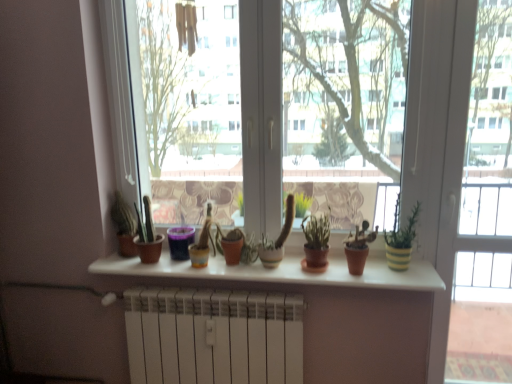
What do you see at coordinates (180, 242) in the screenshot?
I see `purple plastic cup at center, the first flowerpot when ordered from left to right` at bounding box center [180, 242].

Find the location of `matte terracotta pot at center, arranged as the second flowerpot when viewed from the left`. matte terracotta pot at center, arranged as the second flowerpot when viewed from the left is located at coordinates (232, 250).

Looking at this image, how much space does yellow striped pot at right, which is the second houseplant from left to right, occupy horizontally?

It is 6.03 inches.

In order to face green matte plant at center, which is the second houseplant from right to left, should I rotate leftwards or rightwards?

A 8.235 degree turn to the right will do.

The height and width of the screenshot is (384, 512). Describe the element at coordinates (316, 241) in the screenshot. I see `green matte plant at center, which is the second houseplant from right to left` at that location.

The image size is (512, 384). What do you see at coordinates (213, 337) in the screenshot?
I see `white matte radiator at lower center` at bounding box center [213, 337].

Locate an element on the screen. The width and height of the screenshot is (512, 384). purple plastic cup at center, the first flowerpot when ordered from left to right is located at coordinates (180, 242).

Which of these two, yellow striped pot at right, which is the second houseplant from left to right, or white matte radiator at lower center, is smaller?

Smaller between the two is yellow striped pot at right, which is the second houseplant from left to right.

From the picture: Is yellow striped pot at right, the 1th houseplant positioned from the right, facing towards white matte radiator at lower center?

No, yellow striped pot at right, the 1th houseplant positioned from the right, is not oriented towards white matte radiator at lower center.

In the scene shown: Is transparent glass window at center facing towards white matte radiator at lower center?

No, transparent glass window at center is not aimed at white matte radiator at lower center.

Between point (269, 201) and point (208, 361), which one is positioned behind?

The point (269, 201) is behind.

Based on the photo, considering the sizes of objects transparent glass window at center and white matte radiator at lower center in the image provided, who is bigger, transparent glass window at center or white matte radiator at lower center?

transparent glass window at center.

How different are the orientations of transparent glass window at center and green matte plant at center, which is the 1th houseplant from left to right, in degrees?

The facing directions of transparent glass window at center and green matte plant at center, which is the 1th houseplant from left to right, are 0.562 degrees apart.

From the image's perspective, between transparent glass window at center and green matte plant at center, which is the second houseplant from right to left, who is located below?

green matte plant at center, which is the second houseplant from right to left, from the image's perspective.

Does transparent glass window at center turn towards green matte plant at center, which is the 1th houseplant from left to right?

Yes, transparent glass window at center is aimed at green matte plant at center, which is the 1th houseplant from left to right.

Considering the relative positions of transparent glass window at center and green matte plant at center, which is the second houseplant from right to left, in the image provided, is transparent glass window at center behind green matte plant at center, which is the second houseplant from right to left,?

No, transparent glass window at center is closer to the viewer.

From a real-world perspective, which is physically above, green matte plant at center, which is the 1th houseplant from left to right, or purple plastic cup at center, which ranks as the 2th flowerpot in right-to-left order?

green matte plant at center, which is the 1th houseplant from left to right.

Between green matte plant at center, which is the 1th houseplant from left to right, and purple plastic cup at center, the first flowerpot when ordered from left to right, which one is positioned behind?

purple plastic cup at center, the first flowerpot when ordered from left to right, is behind.

Based on their positions, is green matte plant at center, which is the second houseplant from right to left, located to the left or right of purple plastic cup at center, the first flowerpot when ordered from left to right?

Based on their positions, green matte plant at center, which is the second houseplant from right to left, is located to the right of purple plastic cup at center, the first flowerpot when ordered from left to right.

Is matte terracotta pot at center, arranged as the second flowerpot when viewed from the left, to the right of green matte plant at center, which is the second houseplant from right to left, from the viewer's perspective?

In fact, matte terracotta pot at center, arranged as the second flowerpot when viewed from the left, is to the left of green matte plant at center, which is the second houseplant from right to left.

From the image's perspective, is matte terracotta pot at center, arranged as the second flowerpot when viewed from the left, on top of green matte plant at center, which is the 1th houseplant from left to right?

No, from the image's perspective, matte terracotta pot at center, arranged as the second flowerpot when viewed from the left, is not above green matte plant at center, which is the 1th houseplant from left to right.

Can you tell me how much matte terracotta pot at center, which is the 1th flowerpot from right to left, and green matte plant at center, which is the second houseplant from right to left, differ in facing direction?

There is a 1.45-degree angle between the facing directions of matte terracotta pot at center, which is the 1th flowerpot from right to left, and green matte plant at center, which is the second houseplant from right to left.

Does point (231, 245) come closer to viewer compared to point (308, 248)?

No, (231, 245) is further to viewer.

Considering the positions of objects yellow striped pot at right, the 1th houseplant positioned from the right, and matte terracotta pot at center, arranged as the second flowerpot when viewed from the left, in the image provided, who is in front, yellow striped pot at right, the 1th houseplant positioned from the right, or matte terracotta pot at center, arranged as the second flowerpot when viewed from the left,?

Positioned in front is yellow striped pot at right, the 1th houseplant positioned from the right.

Considering the relative sizes of yellow striped pot at right, the 1th houseplant positioned from the right, and matte terracotta pot at center, arranged as the second flowerpot when viewed from the left, in the image provided, is yellow striped pot at right, the 1th houseplant positioned from the right, thinner than matte terracotta pot at center, arranged as the second flowerpot when viewed from the left,?

Indeed, yellow striped pot at right, the 1th houseplant positioned from the right, has a lesser width compared to matte terracotta pot at center, arranged as the second flowerpot when viewed from the left.

From the image's perspective, who appears lower, yellow striped pot at right, the 1th houseplant positioned from the right, or matte terracotta pot at center, arranged as the second flowerpot when viewed from the left?

matte terracotta pot at center, arranged as the second flowerpot when viewed from the left, is shown below in the image.

Can you confirm if yellow striped pot at right, which is the second houseplant from left to right, is positioned to the right of matte terracotta pot at center, which is the 1th flowerpot from right to left?

Indeed, yellow striped pot at right, which is the second houseplant from left to right, is positioned on the right side of matte terracotta pot at center, which is the 1th flowerpot from right to left.

From a real-world perspective, does matte terracotta pot at center, arranged as the second flowerpot when viewed from the left, sit lower than purple plastic cup at center, the first flowerpot when ordered from left to right?

Yes, from a real-world perspective, matte terracotta pot at center, arranged as the second flowerpot when viewed from the left, is under purple plastic cup at center, the first flowerpot when ordered from left to right.

Can you confirm if matte terracotta pot at center, arranged as the second flowerpot when viewed from the left, is wider than purple plastic cup at center, which ranks as the 2th flowerpot in right-to-left order?

Correct, the width of matte terracotta pot at center, arranged as the second flowerpot when viewed from the left, exceeds that of purple plastic cup at center, which ranks as the 2th flowerpot in right-to-left order.

Considering the relative sizes of matte terracotta pot at center, arranged as the second flowerpot when viewed from the left, and purple plastic cup at center, the first flowerpot when ordered from left to right, in the image provided, is matte terracotta pot at center, arranged as the second flowerpot when viewed from the left, smaller than purple plastic cup at center, the first flowerpot when ordered from left to right,?

Indeed, matte terracotta pot at center, arranged as the second flowerpot when viewed from the left, has a smaller size compared to purple plastic cup at center, the first flowerpot when ordered from left to right.

You are a GUI agent. You are given a task and a screenshot of the screen. Output one action in this format:
    pyautogui.click(x=<x>, y=<y>)
    Task: Click on the houseplant that is the 2nd one when counting upward from the white matte radiator at lower center (from the image's perspective)
    This screenshot has height=384, width=512.
    Given the screenshot: What is the action you would take?
    pyautogui.click(x=401, y=240)

I want to click on window screen in front of the white matte radiator at lower center, so click(257, 105).

Looking at the image, which one is located further to green matte plant at center, which is the second houseplant from right to left, yellow striped pot at right, which is the second houseplant from left to right, or transparent glass window at center?

Among the two, transparent glass window at center is located further to green matte plant at center, which is the second houseplant from right to left.

Looking at the image, which one is located closer to purple plastic cup at center, the first flowerpot when ordered from left to right, matte terracotta pot at center, which is the 1th flowerpot from right to left, or yellow striped pot at right, which is the second houseplant from left to right?

matte terracotta pot at center, which is the 1th flowerpot from right to left.

When comparing their distances from transparent glass screen door at right, does matte terracotta pot at center, which is the 1th flowerpot from right to left, or matte white shelf at center seem closer?

matte white shelf at center lies closer to transparent glass screen door at right than the other object.

Looking at the image, which one is located further to yellow striped pot at right, which is the second houseplant from left to right, matte white shelf at center or transparent glass screen door at right?

transparent glass screen door at right lies further to yellow striped pot at right, which is the second houseplant from left to right, than the other object.

When comparing their distances from matte white shelf at center, does yellow striped pot at right, which is the second houseplant from left to right, or matte terracotta pot at center, arranged as the second flowerpot when viewed from the left, seem closer?

yellow striped pot at right, which is the second houseplant from left to right, is closer to matte white shelf at center.

When comparing their distances from green matte plant at center, which is the 1th houseplant from left to right, does white matte radiator at lower center or yellow striped pot at right, the 1th houseplant positioned from the right, seem further?

white matte radiator at lower center.

Looking at the image, which one is located closer to green matte plant at center, which is the 1th houseplant from left to right, white matte radiator at lower center or matte white shelf at center?

matte white shelf at center is closer to green matte plant at center, which is the 1th houseplant from left to right.

Which object lies nearer to the anchor point purple plastic cup at center, which ranks as the 2th flowerpot in right-to-left order, green matte plant at center, which is the 1th houseplant from left to right, or transparent glass screen door at right?

green matte plant at center, which is the 1th houseplant from left to right, is positioned closer to the anchor purple plastic cup at center, which ranks as the 2th flowerpot in right-to-left order.

What are the coordinates of `flowerpot between purple plastic cup at center, which ranks as the 2th flowerpot in right-to-left order, and transparent glass screen door at right` in the screenshot? It's located at (232, 250).

Identify the location of houseplant located between purple plastic cup at center, the first flowerpot when ordered from left to right, and yellow striped pot at right, the 1th houseplant positioned from the right, in the left-right direction. This screenshot has height=384, width=512. (316, 241).

Locate an element on the screen. The height and width of the screenshot is (384, 512). window screen located between purple plastic cup at center, which ranks as the 2th flowerpot in right-to-left order, and yellow striped pot at right, which is the second houseplant from left to right, in the left-right direction is located at coordinates (257, 105).

The image size is (512, 384). What are the coordinates of `houseplant between transparent glass window at center and yellow striped pot at right, which is the second houseplant from left to right, in the horizontal direction` in the screenshot? It's located at (316, 241).